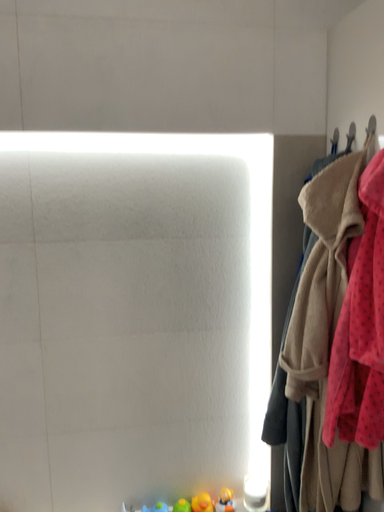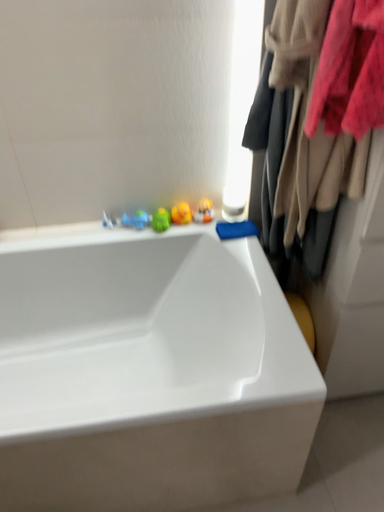
Question: How did the camera likely rotate when shooting the video?

Choices:
 (A) rotated downward
 (B) rotated upward

Answer: (A)